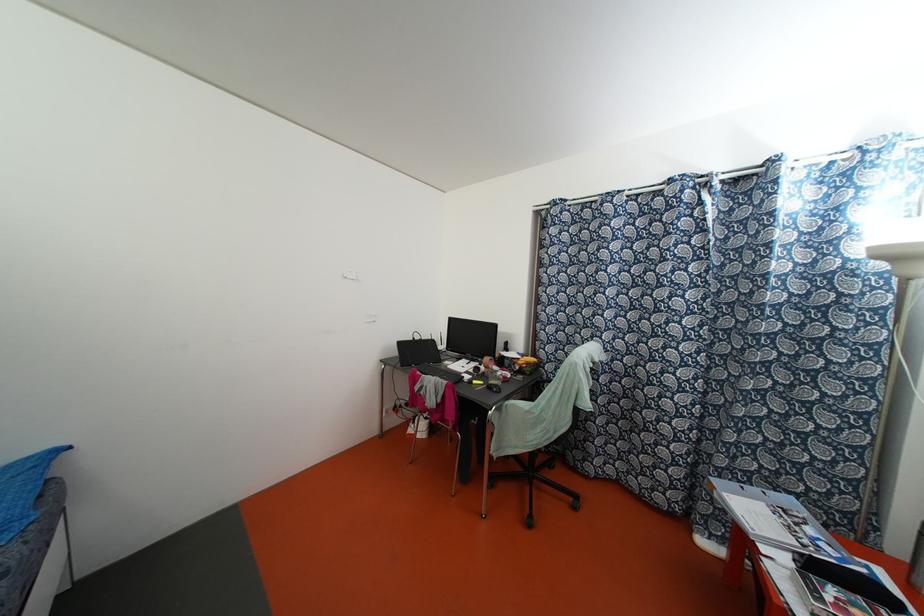
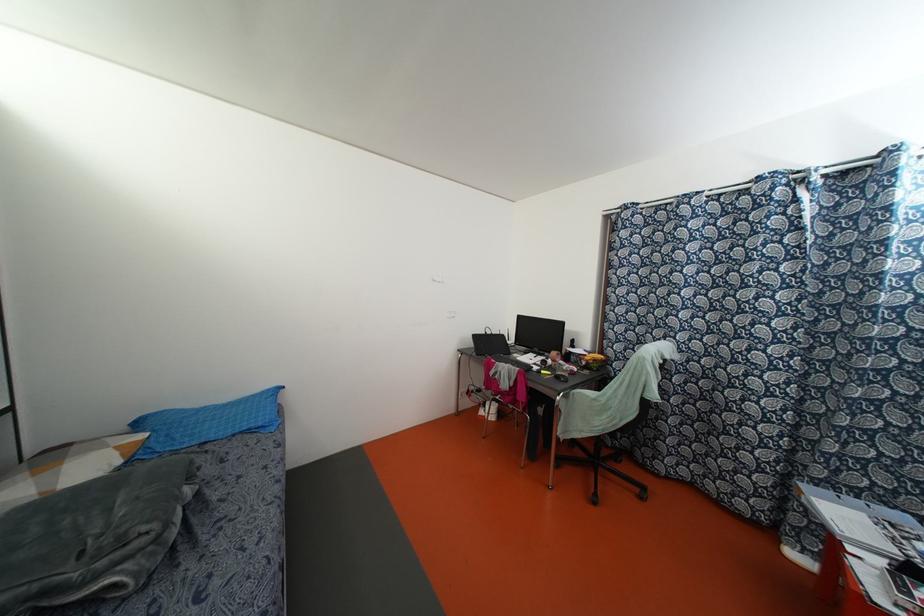
Where in the second image is the point corresponding to point 399,342 from the first image?

(473, 336)